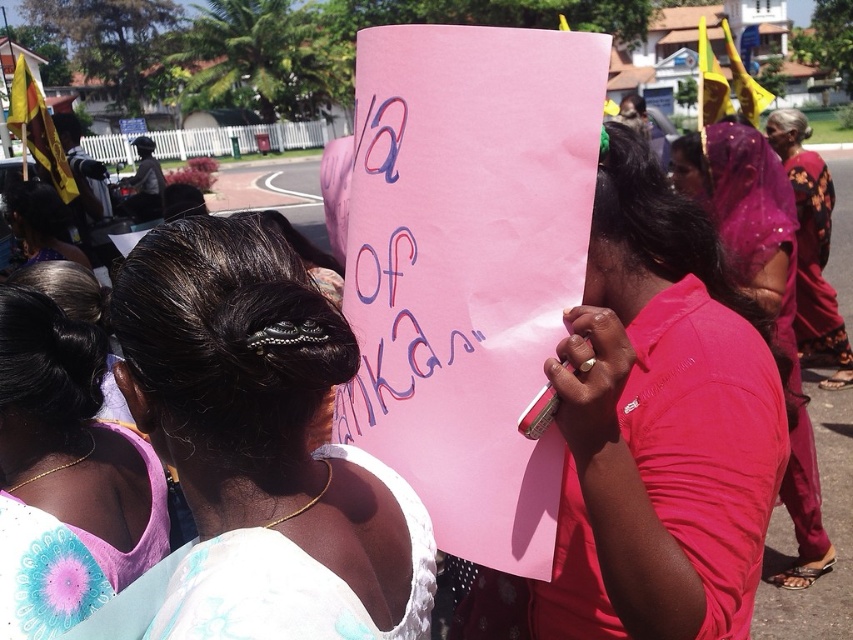
Is purple fabric blouse at upper left positioned at the back of purple sheer veil at upper right?

No, purple fabric blouse at upper left is closer to the viewer.

Does purple fabric blouse at upper left have a greater width compared to purple sheer veil at upper right?

No.

Is point (4, 285) closer to viewer compared to point (734, 161)?

That is True.

Find the location of a particular element. This screenshot has width=853, height=640. purple fabric blouse at upper left is located at coordinates (65, 476).

Is pink paper sign at center to the right of floral silk sari at right from the viewer's perspective?

Incorrect, pink paper sign at center is not on the right side of floral silk sari at right.

Does pink paper sign at center have a lesser width compared to floral silk sari at right?

Indeed, pink paper sign at center has a lesser width compared to floral silk sari at right.

Who is more forward, (740, 493) or (834, 310)?

Positioned in front is point (740, 493).

Where is `pink paper sign at center`? This screenshot has height=640, width=853. pink paper sign at center is located at coordinates (653, 433).

Find the location of a particular element. This screenshot has height=640, width=853. purple sheer veil at upper right is located at coordinates (762, 294).